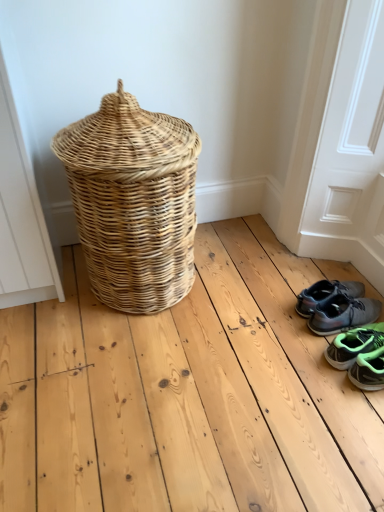
Question: Is gray fabric sneakers at lower right, which is counted as the 2th footwear, starting from the front, not inside natural wicker basket at left?

Choices:
 (A) yes
 (B) no

Answer: (A)

Question: From a real-world perspective, is gray fabric sneakers at lower right, which is counted as the 2th footwear, starting from the front, located higher than natural wicker basket at left?

Choices:
 (A) yes
 (B) no

Answer: (B)

Question: From the image's perspective, is gray fabric sneakers at lower right, which appears as the second footwear when viewed from the back, under natural wicker basket at left?

Choices:
 (A) yes
 (B) no

Answer: (A)

Question: Can you confirm if gray fabric sneakers at lower right, which appears as the second footwear when viewed from the back, is wider than natural wicker basket at left?

Choices:
 (A) no
 (B) yes

Answer: (A)

Question: Is gray fabric sneakers at lower right, which is counted as the 2th footwear, starting from the front, oriented away from natural wicker basket at left?

Choices:
 (A) yes
 (B) no

Answer: (B)

Question: Considering the relative sizes of gray fabric sneakers at lower right, which appears as the second footwear when viewed from the back, and natural wicker basket at left in the image provided, is gray fabric sneakers at lower right, which appears as the second footwear when viewed from the back, taller than natural wicker basket at left?

Choices:
 (A) no
 (B) yes

Answer: (A)

Question: Does gray fabric sneakers at lower right, which is counted as the 2th footwear, starting from the front, lie behind gray synthetic sneakers at lower right, positioned as the first footwear in back-to-front order?

Choices:
 (A) no
 (B) yes

Answer: (A)

Question: Is gray fabric sneakers at lower right, which is counted as the 2th footwear, starting from the front, closer to the viewer compared to gray synthetic sneakers at lower right, which is the 3th footwear from front to back?

Choices:
 (A) no
 (B) yes

Answer: (B)

Question: Does gray fabric sneakers at lower right, which is counted as the 2th footwear, starting from the front, have a greater height compared to gray synthetic sneakers at lower right, positioned as the first footwear in back-to-front order?

Choices:
 (A) yes
 (B) no

Answer: (B)

Question: Is gray fabric sneakers at lower right, which is counted as the 2th footwear, starting from the front, to the right of gray synthetic sneakers at lower right, positioned as the first footwear in back-to-front order, from the viewer's perspective?

Choices:
 (A) no
 (B) yes

Answer: (B)

Question: Does gray fabric sneakers at lower right, which is counted as the 2th footwear, starting from the front, appear on the left side of gray synthetic sneakers at lower right, which is the 3th footwear from front to back?

Choices:
 (A) no
 (B) yes

Answer: (A)

Question: Is gray fabric sneakers at lower right, which appears as the second footwear when viewed from the back, looking in the opposite direction of gray synthetic sneakers at lower right, positioned as the first footwear in back-to-front order?

Choices:
 (A) no
 (B) yes

Answer: (A)

Question: Is gray synthetic sneakers at lower right, which is the 3th footwear from front to back, wider than natural wicker basket at left?

Choices:
 (A) no
 (B) yes

Answer: (A)